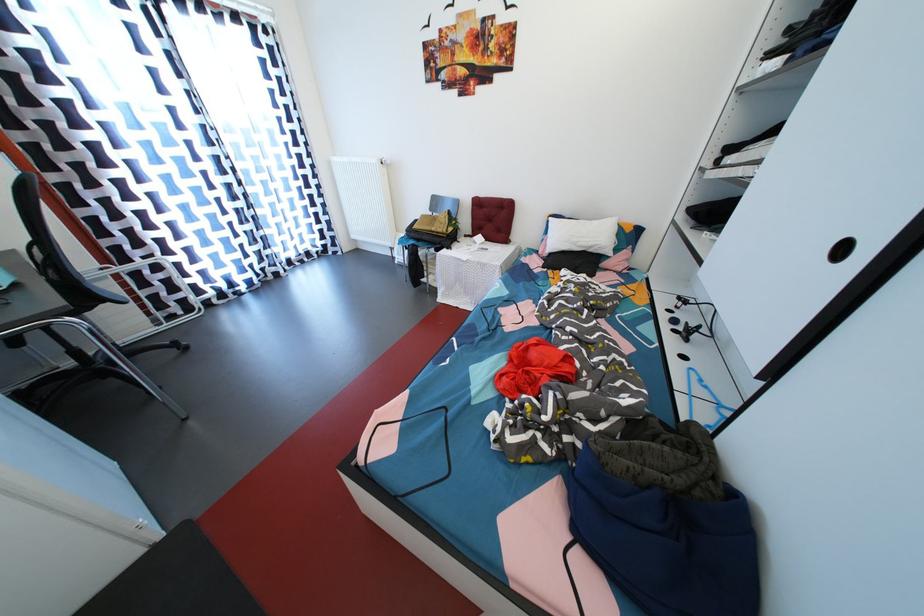
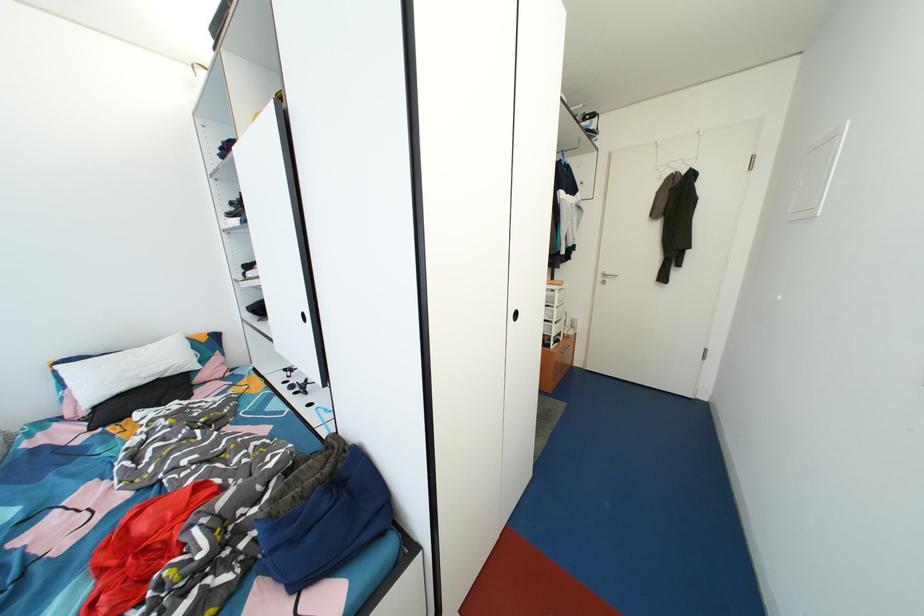
Locate, in the second image, the point that corresponds to point 597,249 in the first image.

(167, 373)